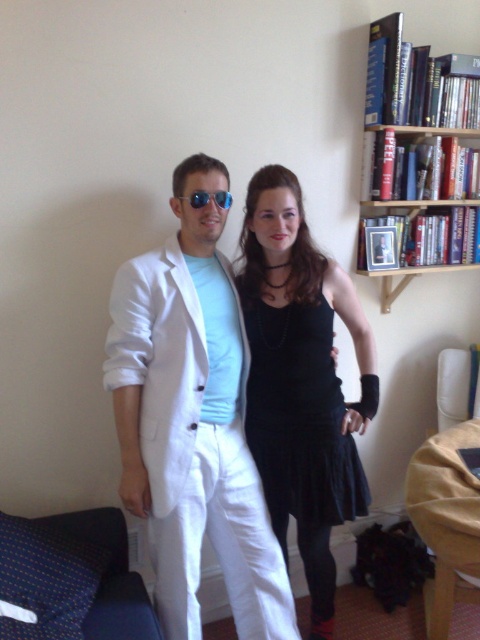
Is white matte suit at center below wooden bookshelf at upper right?

Yes, white matte suit at center is below wooden bookshelf at upper right.

Is white matte suit at center further to the viewer compared to wooden bookshelf at upper right?

No, it is not.

Find the location of a particular element. white matte suit at center is located at coordinates (192, 420).

Between point (262, 344) and point (251, 380), which one is positioned in front?

Point (262, 344) is in front.

Does point (312, 371) come in front of point (267, 499)?

That is True.

At what (x,y) coordinates should I click in order to perform the action: click on black satin dress at center. Please return your answer as a coordinate pair (x, y). Image resolution: width=480 pixels, height=640 pixels. Looking at the image, I should click on (301, 380).

Who is more forward, (269,614) or (254,410)?

Point (269,614)

Is white matte suit at center below black velvet dress at center?

Incorrect, white matte suit at center is not positioned below black velvet dress at center.

This screenshot has height=640, width=480. In order to click on white matte suit at center in this screenshot , I will do `click(192, 420)`.